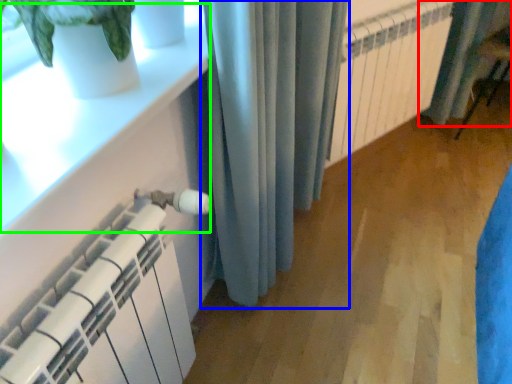
Question: Which object is the farthest from curtain (highlighted by a red box)? Choose among these: curtain (highlighted by a blue box) or window sill (highlighted by a green box).

Choices:
 (A) curtain
 (B) window sill

Answer: (B)